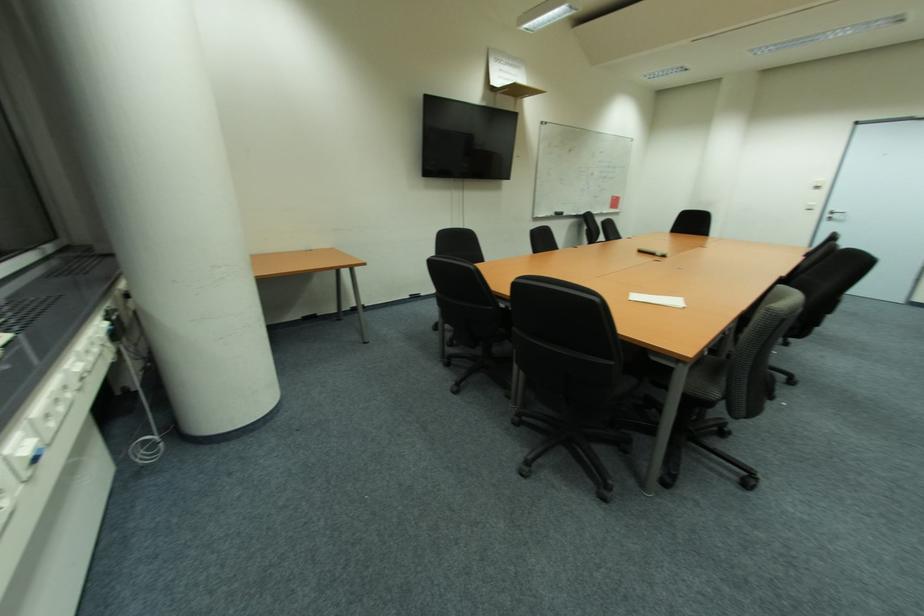
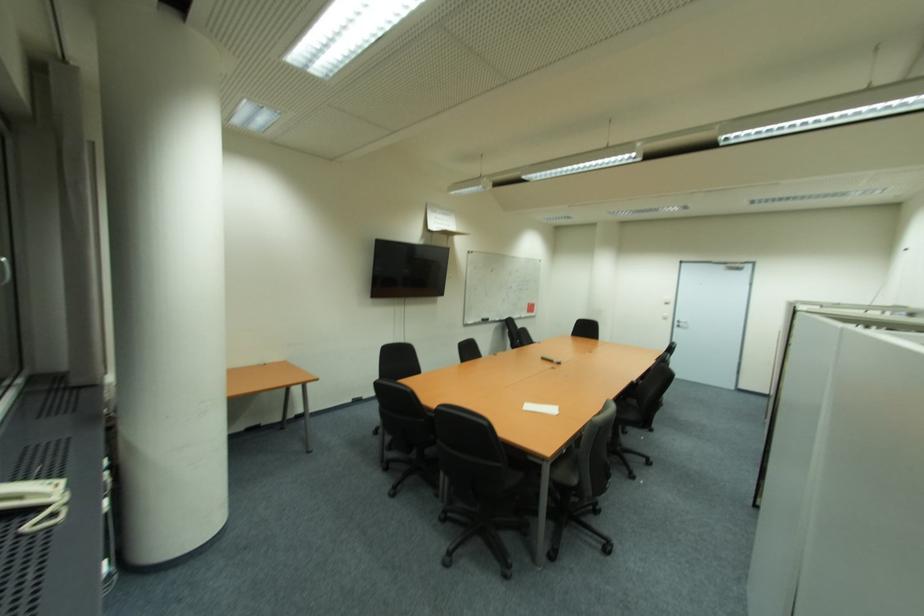
In the second image, find the point that corresponds to (x=842, y=217) in the first image.

(686, 325)